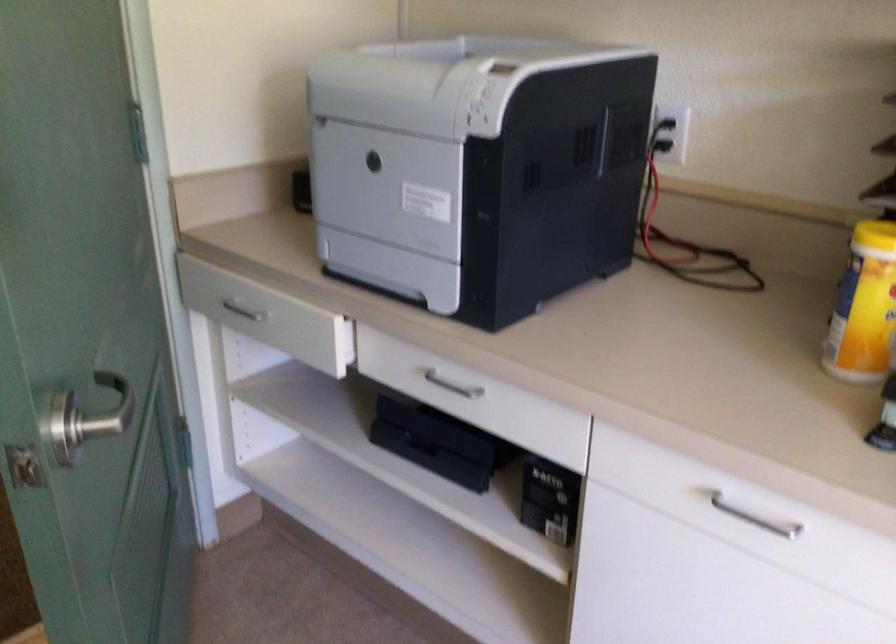
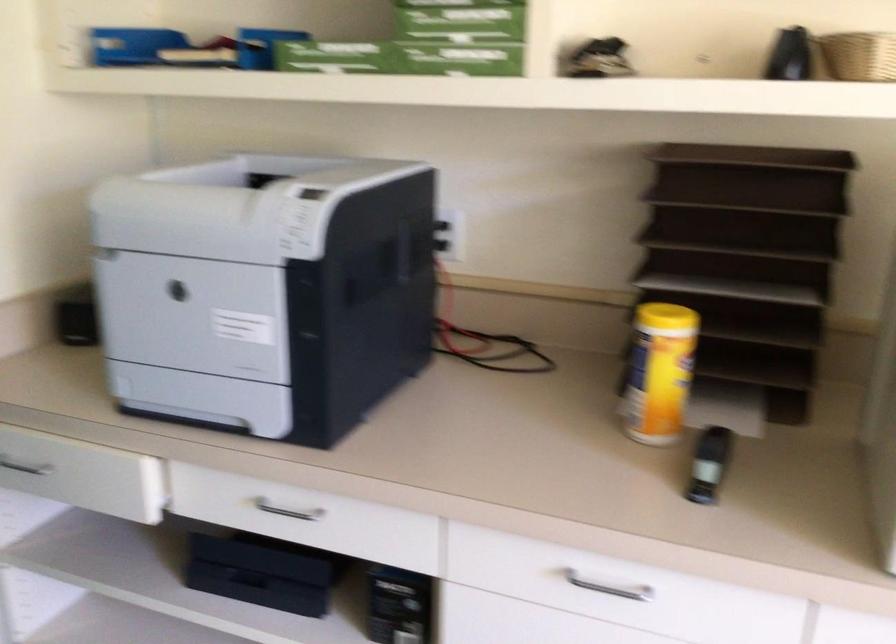
Locate, in the second image, the point that corresponds to pixel 382 187 in the first image.

(194, 315)